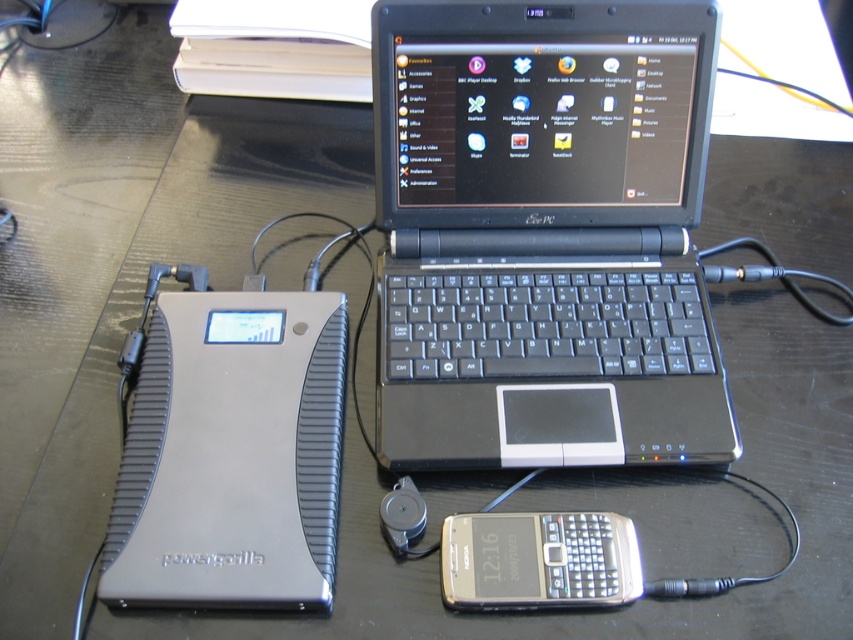
Between black plastic laptop at center and silver metallic power bank at lower left, which one has less height?

silver metallic power bank at lower left is shorter.

Which is behind, point (387, 432) or point (293, 348)?

The point (293, 348) is behind.

Who is more distant from viewer, (688, 344) or (117, 515)?

The point (688, 344) is behind.

This screenshot has width=853, height=640. I want to click on black plastic laptop at center, so click(544, 234).

Can you confirm if black plastic laptop at center is bigger than silver metallic smartphone at lower center?

Correct, black plastic laptop at center is larger in size than silver metallic smartphone at lower center.

Which is below, black plastic laptop at center or silver metallic smartphone at lower center?

silver metallic smartphone at lower center is lower down.

Locate an element on the screen. The image size is (853, 640). black plastic laptop at center is located at coordinates (544, 234).

Locate an element on the screen. black plastic laptop at center is located at coordinates (544, 234).

Between silver metallic power bank at lower left and silver metallic smartphone at lower center, which one is positioned lower?

silver metallic smartphone at lower center

Who is more forward, (248,470) or (538,582)?

Point (538,582) is more forward.

Does point (169, 557) lie behind point (618, 557)?

No, (169, 557) is closer to viewer.

Locate an element on the screen. The width and height of the screenshot is (853, 640). silver metallic power bank at lower left is located at coordinates (231, 454).